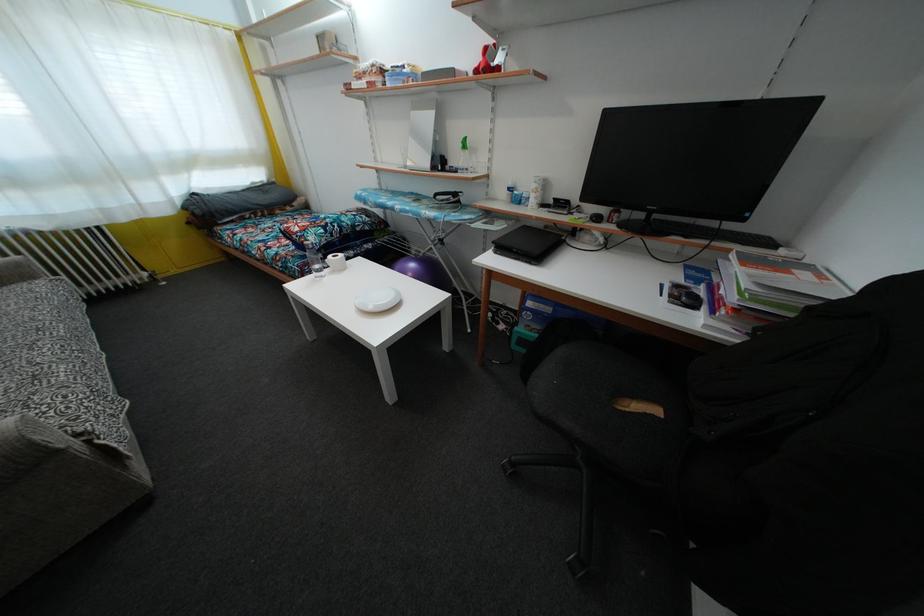
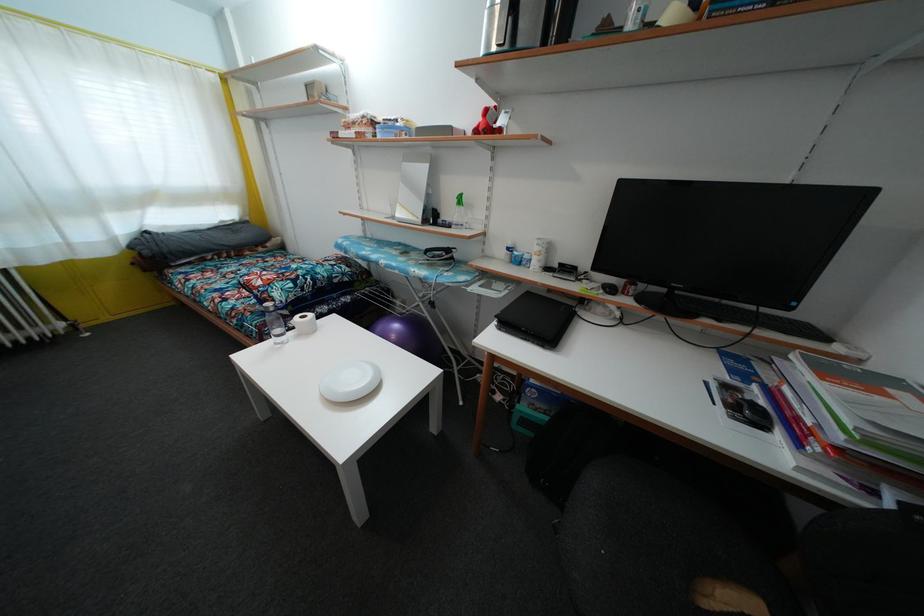
Find the pixel in the second image that matches pixel 385 306 in the first image.

(359, 387)